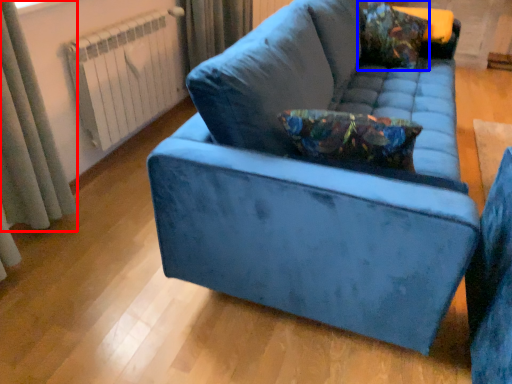
Question: Which point is further to the camera, curtain (highlighted by a red box) or throw pillow (highlighted by a blue box)?

Choices:
 (A) curtain
 (B) throw pillow

Answer: (B)